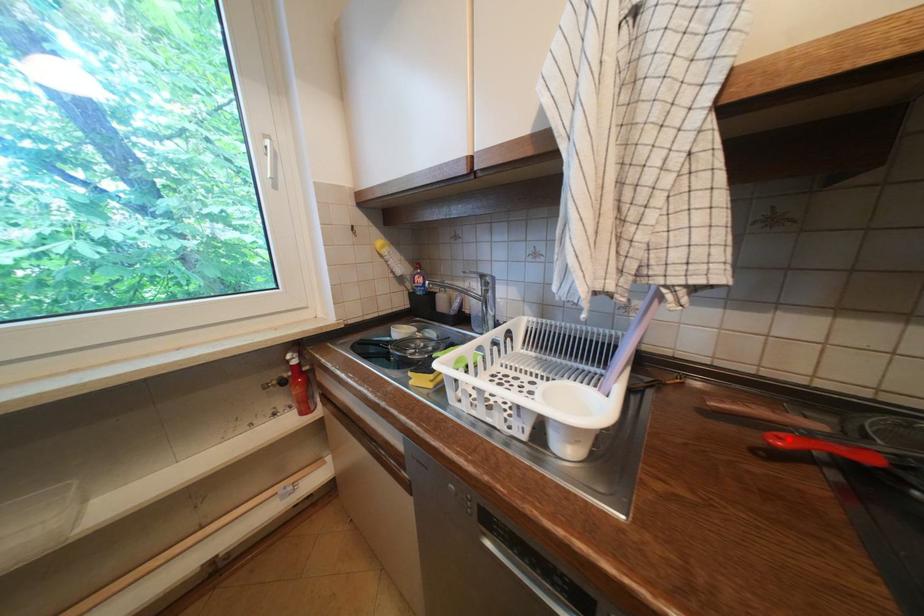
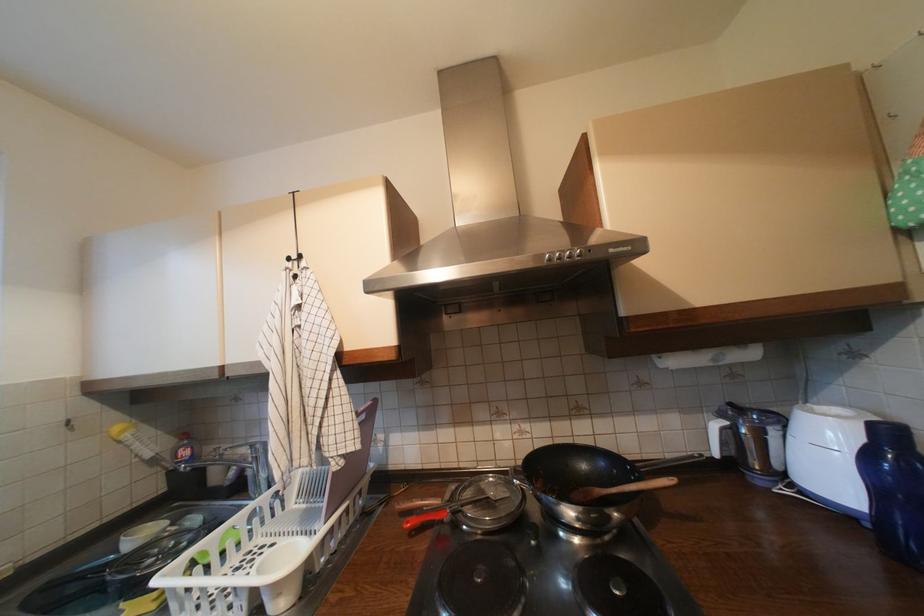
The point at the highlighted location is marked in the first image. Where is the corresponding point in the second image?

(417, 524)